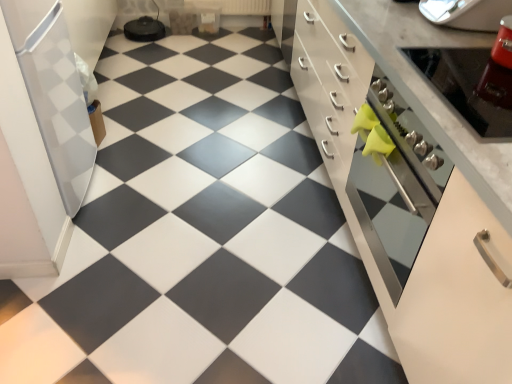
Question: From the image's perspective, would you say white glossy cabinet at center is positioned over white glossy refrigerator at left, marked as the 1th appliance in a left-to-right arrangement?

Choices:
 (A) yes
 (B) no

Answer: (B)

Question: Could you tell me if white glossy cabinet at center is facing white glossy refrigerator at left, marked as the 1th appliance in a left-to-right arrangement?

Choices:
 (A) no
 (B) yes

Answer: (B)

Question: Is white glossy cabinet at center shorter than white glossy refrigerator at left, marked as the 1th appliance in a left-to-right arrangement?

Choices:
 (A) yes
 (B) no

Answer: (A)

Question: Is white glossy cabinet at center further to camera compared to white glossy refrigerator at left, marked as the 1th appliance in a left-to-right arrangement?

Choices:
 (A) yes
 (B) no

Answer: (B)

Question: Does white glossy cabinet at center have a greater height compared to white glossy refrigerator at left, positioned as the 3th appliance in right-to-left order?

Choices:
 (A) yes
 (B) no

Answer: (B)

Question: From the image's perspective, is metallic silver oven at right, which is counted as the 2th appliance, starting from the left, located above or below metallic silver oven at right?

Choices:
 (A) below
 (B) above

Answer: (B)

Question: Considering the positions of point (509, 127) and point (406, 105), is point (509, 127) closer or farther from the camera than point (406, 105)?

Choices:
 (A) closer
 (B) farther

Answer: (A)

Question: Is metallic silver oven at right, the 2th appliance viewed from the right, wider or thinner than metallic silver oven at right?

Choices:
 (A) wide
 (B) thin

Answer: (B)

Question: Considering the positions of metallic silver oven at right, which is counted as the 2th appliance, starting from the left, and metallic silver oven at right in the image, is metallic silver oven at right, which is counted as the 2th appliance, starting from the left, bigger or smaller than metallic silver oven at right?

Choices:
 (A) big
 (B) small

Answer: (B)

Question: From a real-world perspective, is white glossy cabinet at center positioned above or below metallic silver oven at right?

Choices:
 (A) above
 (B) below

Answer: (B)

Question: In terms of size, does white glossy cabinet at center appear bigger or smaller than metallic silver oven at right?

Choices:
 (A) small
 (B) big

Answer: (B)

Question: From the image's perspective, is white glossy cabinet at center located above or below metallic silver oven at right?

Choices:
 (A) below
 (B) above

Answer: (B)

Question: In terms of width, does white glossy cabinet at center look wider or thinner when compared to metallic silver oven at right?

Choices:
 (A) wide
 (B) thin

Answer: (A)

Question: In terms of width, does metallic silver oven at right, the 2th appliance viewed from the right, look wider or thinner when compared to matte black tile at center?

Choices:
 (A) thin
 (B) wide

Answer: (A)

Question: Relative to matte black tile at center, is metallic silver oven at right, which is counted as the 2th appliance, starting from the left, in front or behind?

Choices:
 (A) behind
 (B) front

Answer: (B)